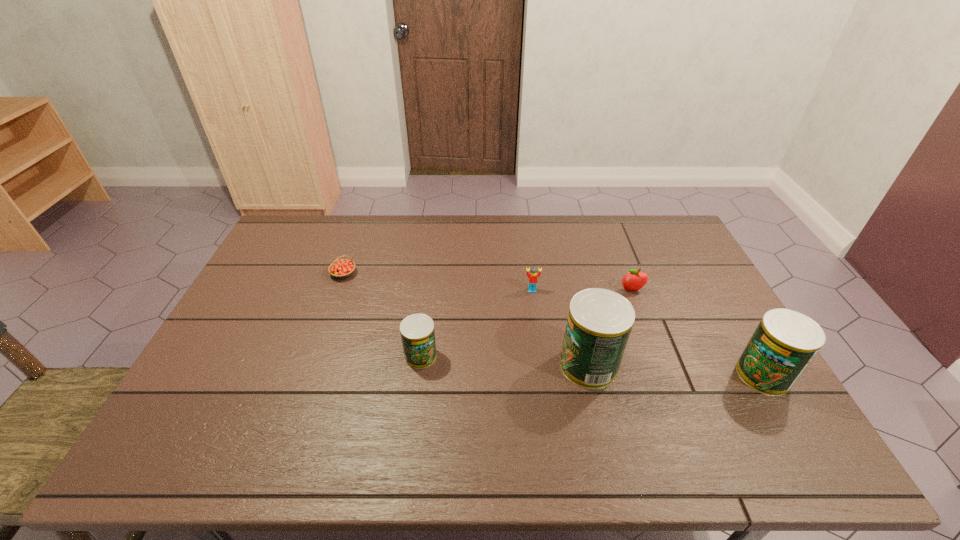
Please point out where to position a new can on the left to maintain spacing. Please provide its 2D coordinates. Your answer should be formatted as a tuple, i.e. [(x, y)], where the tuple contains the x and y coordinates of a point satisfying the conditions above.

[(259, 347)]